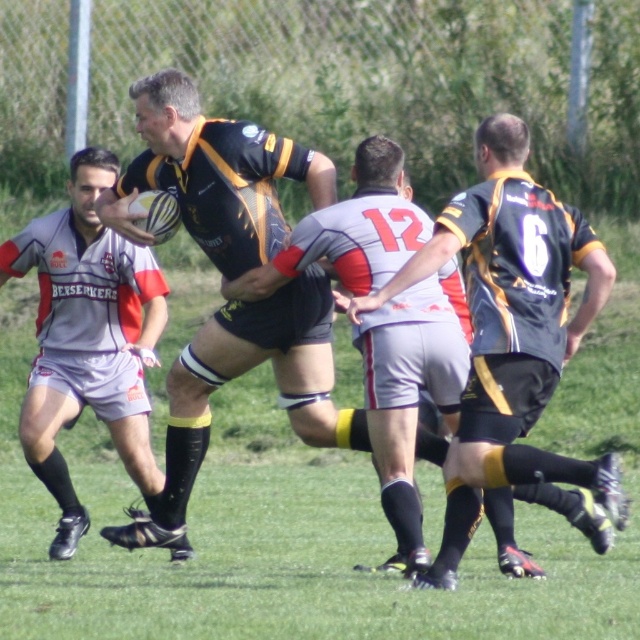
You are a referee standing at the edge of the field. You need to determine if the two players from the same team are within the required 8 meters for a valid pass. The players are the one holding the matte black rugby ball at center and another teammate. How far apart are they?

The two players are 7.79 meters apart, which is within the required 8 meters for a valid pass.

You are a spectator watching the rugby match. You see the matte black jersey at center and the matte black rugby ball at left. Which object is positioned to the right of the other?

The matte black jersey at center is positioned to the right of the matte black rugby ball at left.